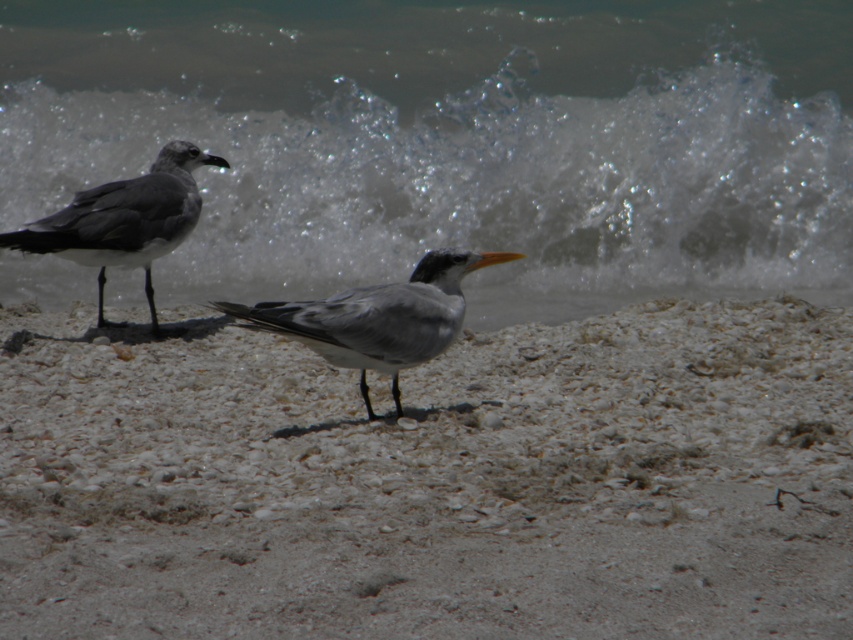
Looking at this image, you are standing at the beach and want to walk to the point marked as point (550, 618). However, there is an obstacle at point (321, 330). Will you encounter the obstacle before reaching your destination?

Point (550, 618) is in front of point (321, 330), so you will encounter the obstacle at point (321, 330) before reaching your destination.

You are standing on the shore and want to walk towards the clear water at upper center. Which direction should you move relative to the white sandy beach at center?

You should move towards the upper direction relative to the white sandy beach at center because the clear water at upper center is located above it and closer to the viewer.

You are a photographer trying to capture both the white sandy beach at center and the gray matte seagull at left in a single shot. Based on their heights, which one should you focus on first to ensure they are both in frame?

The white sandy beach at center is shorter than the gray matte seagull at left, so you should focus on the gray matte seagull at left first to ensure both are in frame.